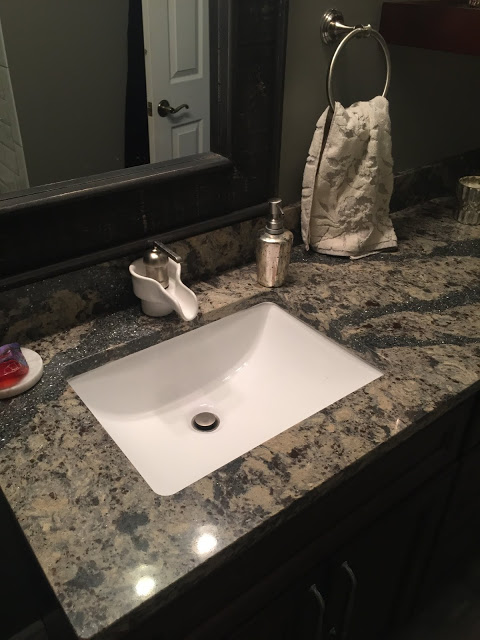
Where is `cabinet door`? cabinet door is located at coordinates (387, 550).